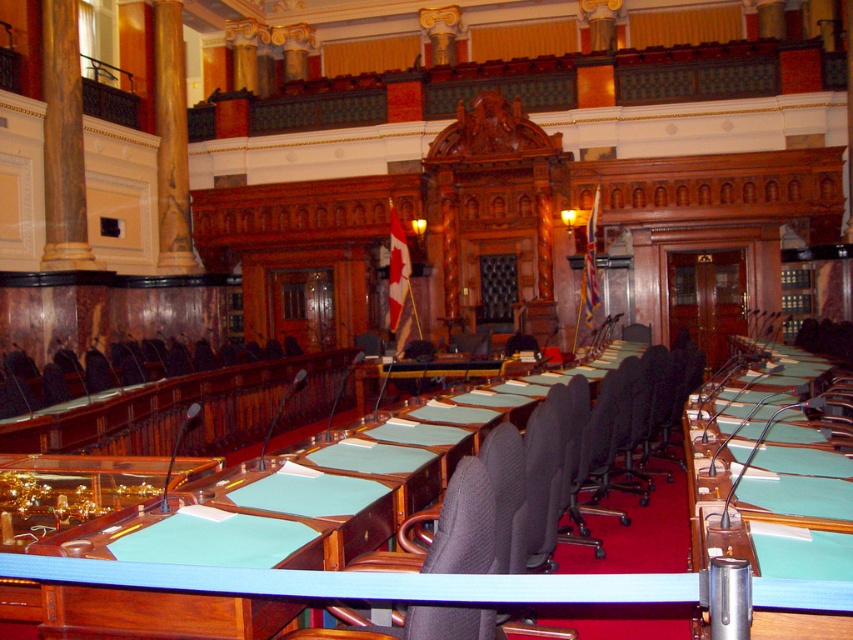
Question: Which is nearer to the black fabric chair at center?

Choices:
 (A) green felt table at center
 (B) rustic wood column at left

Answer: (A)

Question: Estimate the real-world distances between objects in this image. Which object is farther from the matte black chair at left?

Choices:
 (A) black fabric chair at center
 (B) brown polished wood column at left
 (C) rustic wood column at left
 (D) green felt table at center

Answer: (C)

Question: Considering the relative positions of rustic wood column at left and black fabric chair at center in the image provided, where is rustic wood column at left located with respect to black fabric chair at center?

Choices:
 (A) right
 (B) left

Answer: (B)

Question: Does black leather chair at center appear on the left side of black fabric chair at center?

Choices:
 (A) yes
 (B) no

Answer: (B)

Question: Considering the real-world distances, which object is farthest from the green felt table at center?

Choices:
 (A) black fabric chair at center
 (B) black leather chair at center
 (C) brown polished wood column at left
 (D) matte black chair at left

Answer: (C)

Question: Does rustic wood column at left appear over black fabric chair at center?

Choices:
 (A) no
 (B) yes

Answer: (B)